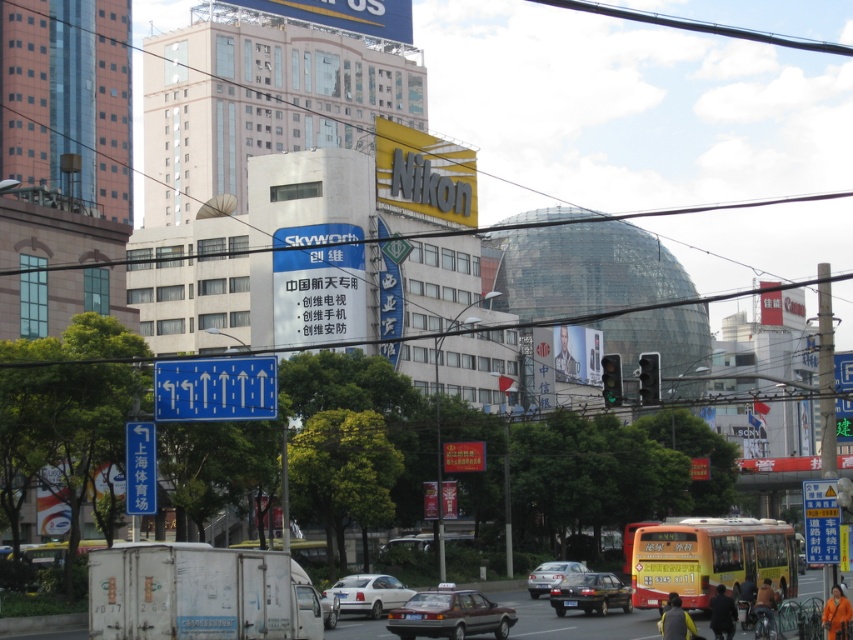
Question: Does metallic pole at right appear on the left side of white matte sedan at center?

Choices:
 (A) yes
 (B) no

Answer: (B)

Question: Estimate the real-world distances between objects in this image. Which object is farther from the matte black sedan at center?

Choices:
 (A) shiny silver sedan at center
 (B) blue glossy sign at upper left
 (C) white matte sedan at center
 (D) matte black car at center

Answer: (A)

Question: Can you confirm if matte black car at center is positioned to the left of white plastic sign at lower left?

Choices:
 (A) no
 (B) yes

Answer: (A)

Question: Which object is farther from the camera taking this photo?

Choices:
 (A) white plastic sign at lower left
 (B) matte black car at center
 (C) blue glossy sign at upper left
 (D) shiny black sedan at center

Answer: (D)

Question: In this image, where is white plastic sign at lower left located relative to shiny black sedan at center?

Choices:
 (A) above
 (B) below

Answer: (A)

Question: Which point is farther to the camera?

Choices:
 (A) (207, 365)
 (B) (408, 608)
 (C) (328, 614)

Answer: (A)